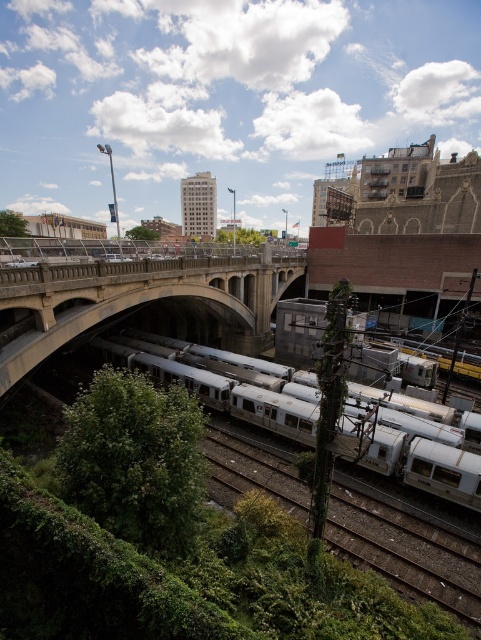
Does metallic train tracks at lower center come behind white metallic train at center?

Yes, metallic train tracks at lower center is further from the viewer.

Between metallic train tracks at lower center and white metallic train at center, which one is positioned lower?

metallic train tracks at lower center

Who is more forward, (393, 572) or (450, 468)?

Point (393, 572)

Find the location of a particular element. The image size is (481, 640). metallic train tracks at lower center is located at coordinates coord(406,547).

Which of these two, concrete bridge at left or white metallic train at center, stands shorter?

With less height is white metallic train at center.

Does concrete bridge at left have a lesser width compared to white metallic train at center?

In fact, concrete bridge at left might be wider than white metallic train at center.

At what (x,y) coordinates should I click in order to perform the action: click on concrete bridge at left. Please return your answer as a coordinate pair (x, y). The height and width of the screenshot is (640, 481). Looking at the image, I should click on (140, 301).

Does concrete bridge at left appear on the right side of metallic train tracks at lower center?

In fact, concrete bridge at left is to the left of metallic train tracks at lower center.

From the picture: Measure the distance from concrete bridge at left to metallic train tracks at lower center.

The distance of concrete bridge at left from metallic train tracks at lower center is 16.86 meters.

Which is behind, point (250, 284) or point (457, 545)?

The point (250, 284) is behind.

You are a GUI agent. You are given a task and a screenshot of the screen. Output one action in this format:
    pyautogui.click(x=<x>, y=<y>)
    Task: Click on the concrete bridge at left
    Image resolution: width=481 pixels, height=640 pixels.
    Given the screenshot: What is the action you would take?
    pyautogui.click(x=140, y=301)